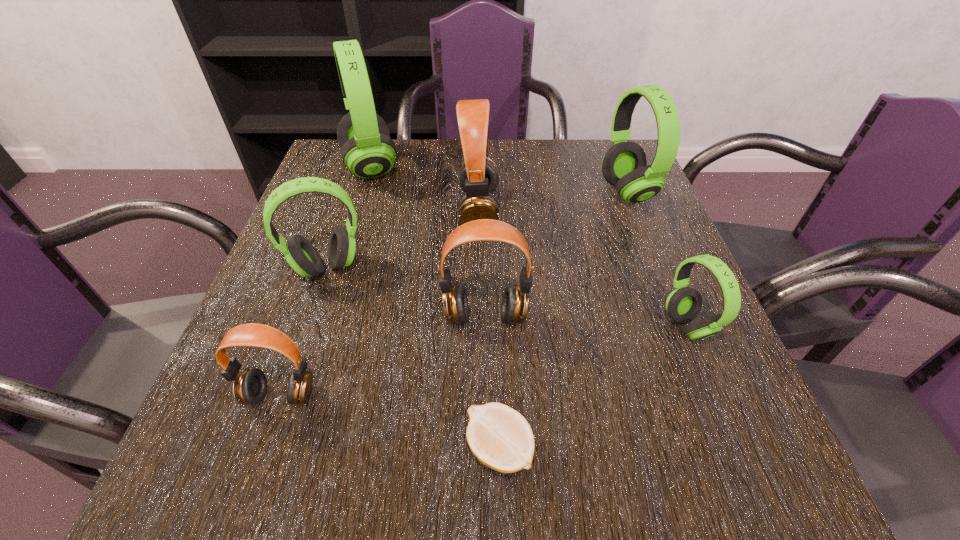
Image resolution: width=960 pixels, height=540 pixels. Find the location of `object located at the near edge`. object located at the near edge is located at coordinates [x=500, y=437].

Locate an element on the screen. The image size is (960, 540). object that is at the far left corner is located at coordinates (367, 150).

The width and height of the screenshot is (960, 540). In order to click on object at the far right corner in this screenshot , I will do `click(624, 166)`.

I want to click on vacant space at the far edge, so click(491, 162).

Identify the location of vacant area at the left edge of the desktop. The width and height of the screenshot is (960, 540). (312, 207).

Identify the location of vacant space at the right edge of the desktop. (694, 399).

In the image, there is a desktop. In order to click on vacant space at the far left corner in this screenshot , I will do `click(330, 158)`.

You are a GUI agent. You are given a task and a screenshot of the screen. Output one action in this format:
    pyautogui.click(x=<x>, y=<y>)
    Task: Click on the blank space at the far right corner of the desktop
    This screenshot has height=540, width=960.
    Given the screenshot: What is the action you would take?
    pyautogui.click(x=591, y=159)

In the image, there is a desktop. What are the coordinates of `vacant space at the near right corner` in the screenshot? It's located at (700, 447).

Image resolution: width=960 pixels, height=540 pixels. Find the location of `vacant space that's between the fourth nearest headset and the nearest object`. vacant space that's between the fourth nearest headset and the nearest object is located at coordinates (414, 358).